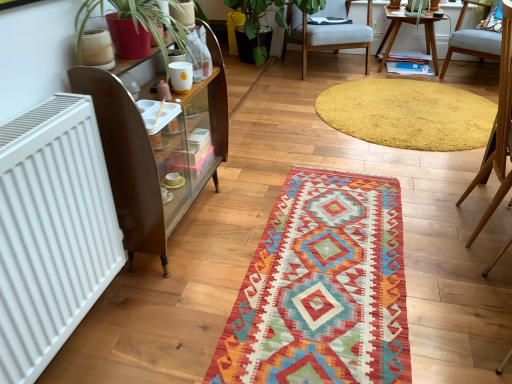
The image size is (512, 384). In order to click on vacant space that is in between yellow shaggy rug at upper center, the second mat when ordered from front to back, and multicolored woven mat at center, the 2th mat positioned from the top in this screenshot , I will do `click(415, 192)`.